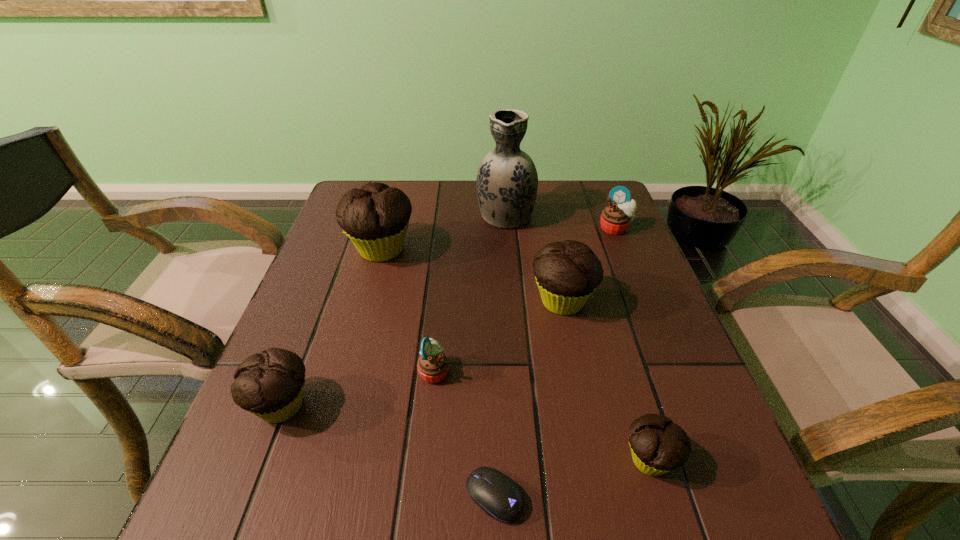
Locate an element on the screen. the tallest object is located at coordinates (x=507, y=181).

In order to click on vase in this screenshot , I will do `click(507, 181)`.

Locate an element on the screen. Image resolution: width=960 pixels, height=540 pixels. the farthest chocolate muffin is located at coordinates (375, 218).

I want to click on the biggest chocolate muffin, so click(x=375, y=218).

Image resolution: width=960 pixels, height=540 pixels. Find the location of `the second biggest chocolate muffin`. the second biggest chocolate muffin is located at coordinates (567, 273).

Identify the location of the fourth nearest muffin. The height and width of the screenshot is (540, 960). (567, 273).

The height and width of the screenshot is (540, 960). What are the coordinates of `the right pink muffin` in the screenshot? It's located at (615, 219).

The image size is (960, 540). I want to click on the farther pink muffin, so click(615, 219).

The image size is (960, 540). I want to click on the second smallest chocolate muffin, so click(270, 385).

The image size is (960, 540). Find the location of `the nearer pink muffin`. the nearer pink muffin is located at coordinates (433, 365).